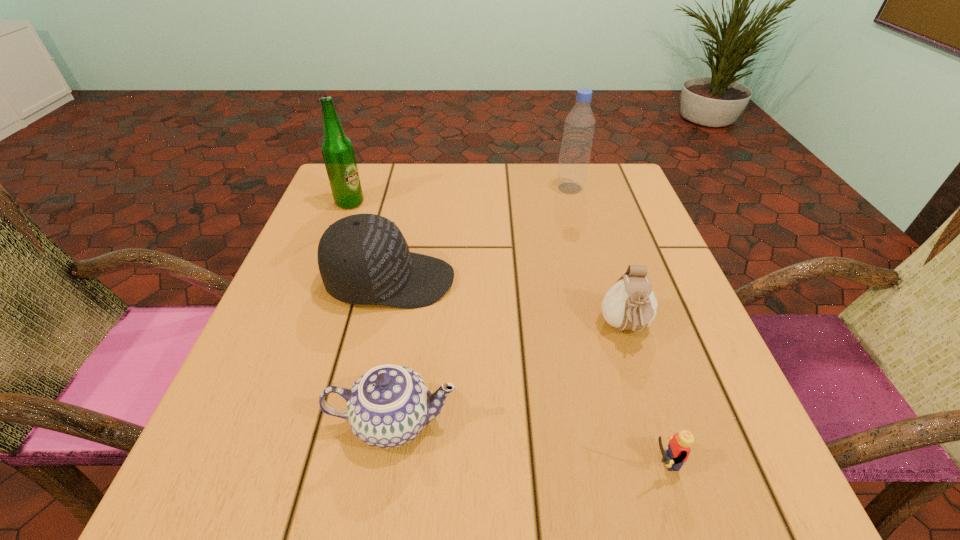
The width and height of the screenshot is (960, 540). I want to click on vacant space located 0.350m from the spout of the chinaware, so click(699, 421).

The image size is (960, 540). What are the coordinates of `vacant space located on the front-facing side of the Lego` in the screenshot? It's located at (457, 462).

Find the location of a particular element. The width and height of the screenshot is (960, 540). vacant point located on the front-facing side of the Lego is located at coordinates (487, 462).

This screenshot has width=960, height=540. I want to click on vacant region located on the front-facing side of the Lego, so pos(568,462).

At what (x,y) coordinates should I click in order to perform the action: click on beer bottle at the far edge. Please return your answer as a coordinate pair (x, y). Looking at the image, I should click on (337, 149).

You are a GUI agent. You are given a task and a screenshot of the screen. Output one action in this format:
    pyautogui.click(x=<x>, y=<y>)
    Task: Click on the bottle present at the far edge
    The image size is (960, 540).
    Given the screenshot: What is the action you would take?
    pyautogui.click(x=579, y=126)

The width and height of the screenshot is (960, 540). I want to click on chinaware that is at the near edge, so click(x=388, y=406).

You are a GUI agent. You are given a task and a screenshot of the screen. Output one action in this format:
    pyautogui.click(x=<x>, y=<y>)
    Task: Click on the Lego that is at the near edge
    Image resolution: width=960 pixels, height=540 pixels.
    Given the screenshot: What is the action you would take?
    pyautogui.click(x=678, y=451)

Locate an element on the screen. The height and width of the screenshot is (540, 960). beer bottle at the left edge is located at coordinates (337, 149).

The image size is (960, 540). What are the coordinates of `baseball cap situated at the left edge` in the screenshot? It's located at (364, 259).